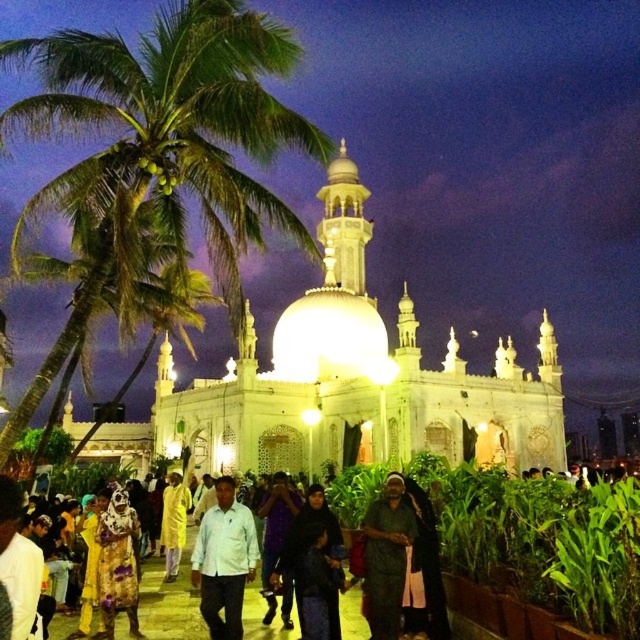
You are standing at the entrance of the mosque and want to find a person wearing a white matte shirt at center. According to the coordinates provided, in which direction should you look to locate them?

The white matte shirt at center is located at point 0.877 on the x axis and 0.350 on the y axis. Since the x coordinate is closer to 1, you should look to the right side of the image, and since the y coordinate is closer to 0.5, you should look towards the middle vertically to locate them.

You are a photographer standing at the entrance of the mosque and want to capture both the dark green fabric at lower left and the dark green fabric at center in your photo. Which dark green fabric should you focus on to ensure it takes up more space in the frame?

The dark green fabric at lower left should be focused on because it has a larger size compared to the dark green fabric at center, making it occupy more space in the frame.

You are standing at the entrance of the mosque and notice two items at the center of the scene. Which one is nearer to you between the white matte shirt at center and the light yellow fabric at center?

The white matte shirt at center is closer to the viewer than the light yellow fabric at center, so the white matte shirt at center is nearer to you.